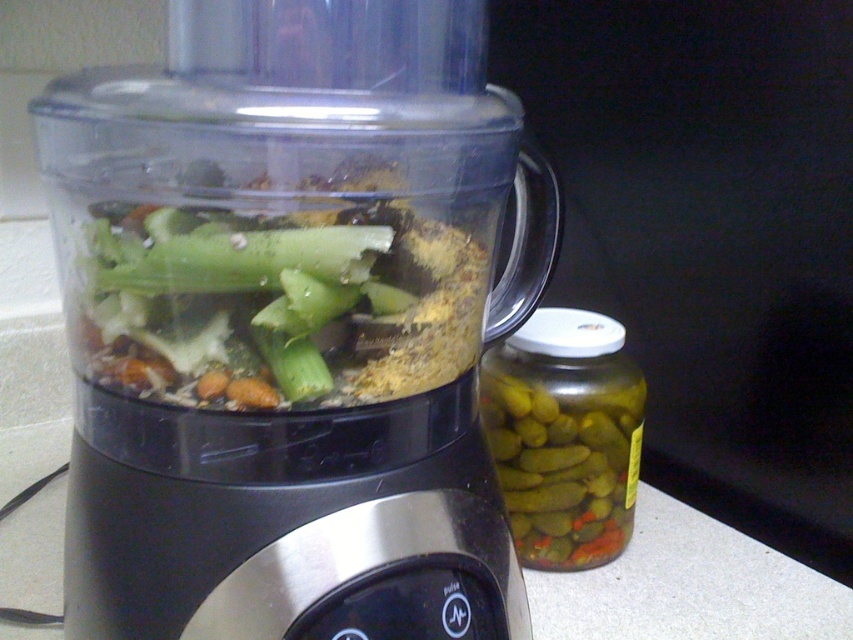
Question: Which of the following is the closest to the observer?

Choices:
 (A) (384, 355)
 (B) (210, 544)
 (C) (639, 416)

Answer: (A)

Question: Is transparent plastic food processor at center positioned in front of green glass jar at right?

Choices:
 (A) yes
 (B) no

Answer: (A)

Question: Based on their relative distances, which object is nearer to the green matte vegetable at center?

Choices:
 (A) green glass jar at right
 (B) transparent plastic food processor at center

Answer: (B)

Question: Can you confirm if transparent plastic food processor at center is wider than green glass jar at right?

Choices:
 (A) no
 (B) yes

Answer: (B)

Question: Considering the real-world distances, which object is closest to the transparent plastic food processor at center?

Choices:
 (A) green glass jar at right
 (B) green matte vegetable at center

Answer: (B)

Question: Is green matte vegetable at center positioned in front of green glass jar at right?

Choices:
 (A) no
 (B) yes

Answer: (B)